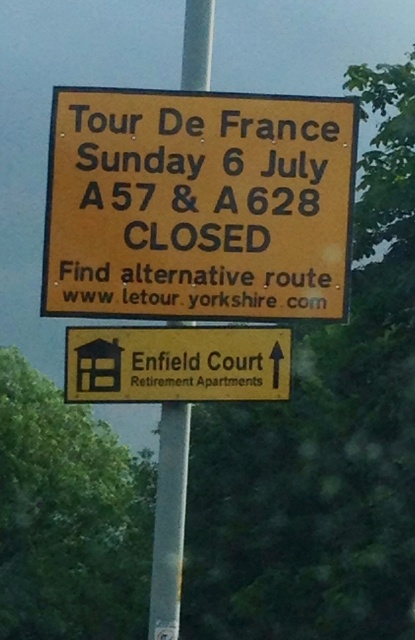
Consider the image. You are a cyclist planning to attend the Tour de France event and see the yellow matte sign at upper center and the silver metallic pole at center. According to the information on the signs, which direction should you avoid to prevent encountering closed roads?

The yellow matte sign at upper center indicates that the A57 and A628 roads will be closed on Sunday 6 July due to the Tour de France event. To avoid closed roads, you should not take routes along the A57 or A628 highways as stated on the yellow matte sign at upper center.

You are a cyclist planning to avoid road closures during the Tour De France. You see the yellow matte sign at upper center and the silver metallic pole at center. Which object is positioned to the right of the other?

The yellow matte sign at upper center is to the right of the silver metallic pole at center according to the description.